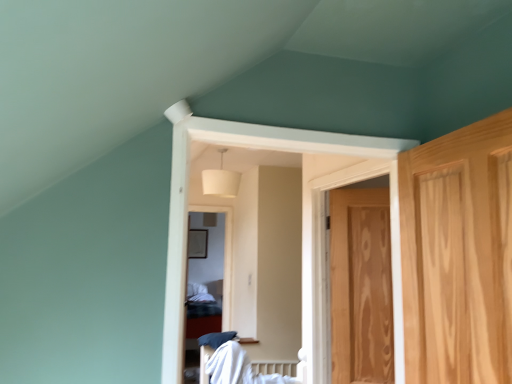
Question: From a real-world perspective, is white cotton bed at center positioned under white fabric lampshade at upper center based on gravity?

Choices:
 (A) no
 (B) yes

Answer: (B)

Question: Is the depth of white cotton bed at center greater than that of white fabric lampshade at upper center?

Choices:
 (A) no
 (B) yes

Answer: (A)

Question: Can you confirm if white cotton bed at center is bigger than white fabric lampshade at upper center?

Choices:
 (A) no
 (B) yes

Answer: (B)

Question: Can we say white cotton bed at center lies outside white fabric lampshade at upper center?

Choices:
 (A) no
 (B) yes

Answer: (B)

Question: Is white cotton bed at center far away from white fabric lampshade at upper center?

Choices:
 (A) yes
 (B) no

Answer: (A)

Question: From a real-world perspective, is white cotton bed at center physically located above or below wooden door at right?

Choices:
 (A) below
 (B) above

Answer: (A)

Question: Is point (239, 372) closer or farther from the camera than point (387, 382)?

Choices:
 (A) farther
 (B) closer

Answer: (A)

Question: Which is correct: white cotton bed at center is inside wooden door at right, or outside of it?

Choices:
 (A) outside
 (B) inside

Answer: (A)

Question: From their relative heights in the image, would you say white cotton bed at center is taller or shorter than wooden door at right?

Choices:
 (A) tall
 (B) short

Answer: (B)

Question: Looking at the image, does white fabric lampshade at upper center seem bigger or smaller compared to wooden door at right?

Choices:
 (A) big
 (B) small

Answer: (A)

Question: From a real-world perspective, is white fabric lampshade at upper center physically located above or below wooden door at right?

Choices:
 (A) above
 (B) below

Answer: (A)

Question: From the image's perspective, is white fabric lampshade at upper center above or below wooden door at right?

Choices:
 (A) above
 (B) below

Answer: (A)

Question: In the image, is white fabric lampshade at upper center on the left side or the right side of wooden door at right?

Choices:
 (A) left
 (B) right

Answer: (A)

Question: From the image's perspective, is white fabric lampshade at upper center positioned above or below white cotton bed at center?

Choices:
 (A) below
 (B) above

Answer: (B)

Question: In terms of width, does white fabric lampshade at upper center look wider or thinner when compared to white cotton bed at center?

Choices:
 (A) wide
 (B) thin

Answer: (B)